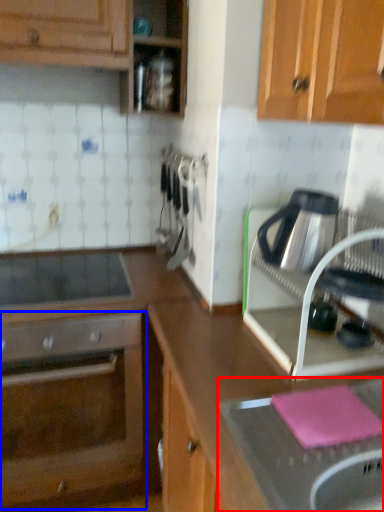
Question: Which of the following is the farthest to the observer, sink (highlighted by a red box) or oven (highlighted by a blue box)?

Choices:
 (A) sink
 (B) oven

Answer: (B)